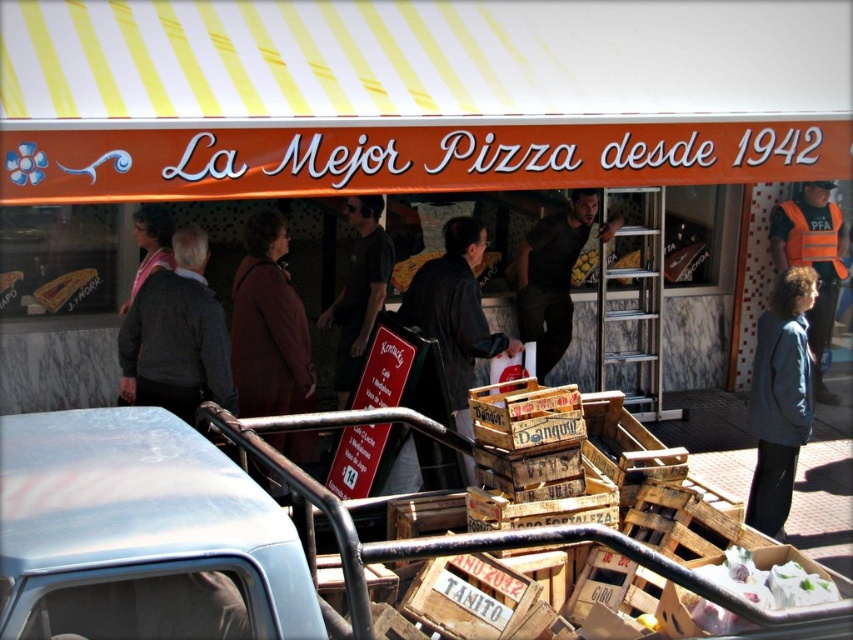
Question: Which point is closer to the camera?

Choices:
 (A) brown wool coat at center
 (B) dark brown leather jacket at center
 (C) matte gray sweater at left

Answer: (A)

Question: Does light blue metallic car at lower left have a smaller size compared to brown wool coat at center?

Choices:
 (A) yes
 (B) no

Answer: (B)

Question: Does blue fabric jacket at lower right appear on the right side of dark brown leather jacket at center?

Choices:
 (A) yes
 (B) no

Answer: (A)

Question: Which point is closer to the camera?

Choices:
 (A) [x=323, y=323]
 (B) [x=161, y=484]
 (C) [x=730, y=564]

Answer: (B)

Question: Which point is farther to the camera?

Choices:
 (A) (780, 241)
 (B) (476, 336)

Answer: (A)

Question: Does blue fabric jacket at lower right appear over orange reflective vest at center?

Choices:
 (A) no
 (B) yes

Answer: (A)